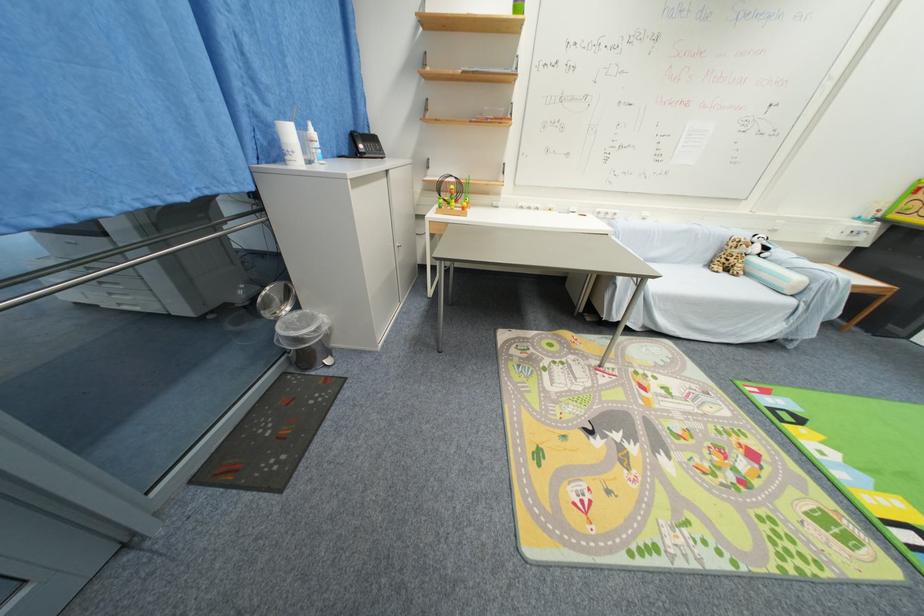
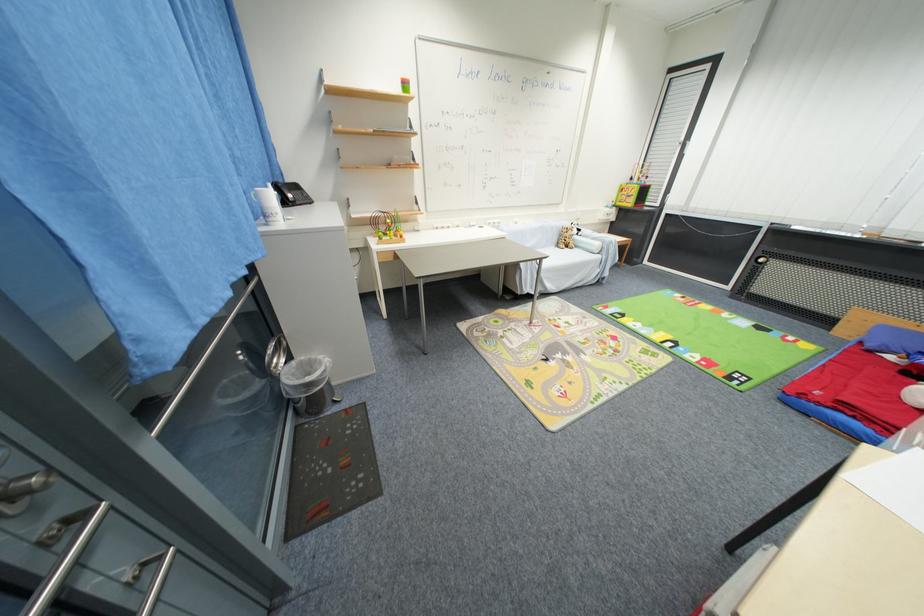
The point at (x=367, y=148) is marked in the first image. Where is the corresponding point in the second image?

(296, 198)